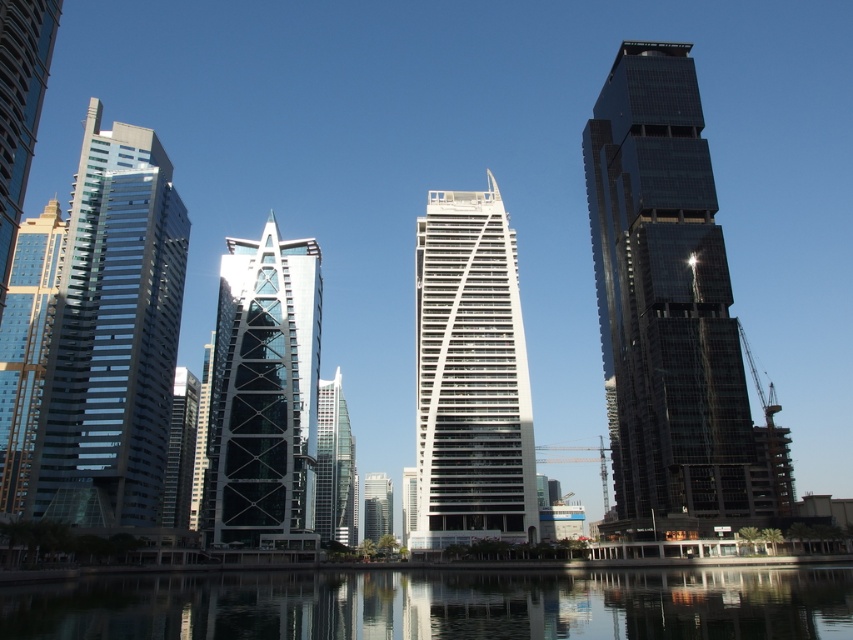
You are an architect evaluating the urban skyline. Which of the two skyscrapers, the shiny glass skyscraper at left or the glassy reflective skyscraper at center, has a greater height?

The shiny glass skyscraper at left is larger in size than the glassy reflective skyscraper at center, so it has a greater height.

You are an architect analyzing the urban skyline. You observe the dark glass skyscraper at center and the glassy silver skyscraper at center. Which one is positioned higher up in the image?

The dark glass skyscraper at center is located above the glassy silver skyscraper at center, so it is positioned higher up in the image.

You are a city planner assessing the skyline. You need to determine which of the two skyscrapers, the glassy steel skyscraper at left or the glassy reflective skyscraper at center, is taller. Based on the image, which one is taller?

The glassy steel skyscraper at left is taller than the glassy reflective skyscraper at center.